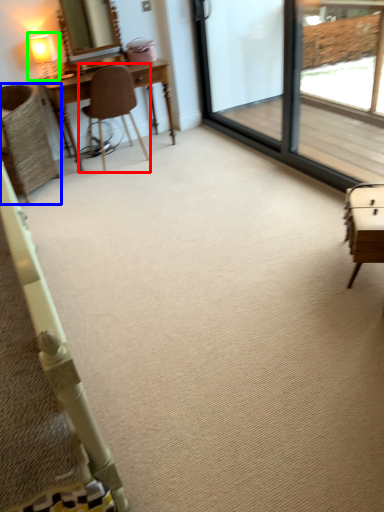
Question: Which object is the farthest from chair (highlighted by a red box)? Choose among these: chair (highlighted by a blue box) or table lamp (highlighted by a green box).

Choices:
 (A) chair
 (B) table lamp

Answer: (B)